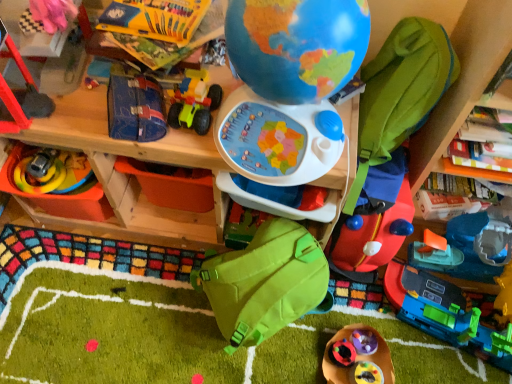
Question: Is blue fabric case at center, which ranks as the 3th toy in left-to-right order, surrounding rubberized red backpack at center-right, which is the first toy in right-to-left order?

Choices:
 (A) yes
 (B) no

Answer: (B)

Question: Is blue fabric case at center, which ranks as the 3th toy in left-to-right order, in front of rubberized red backpack at center-right, acting as the eleventh toy starting from the left?

Choices:
 (A) yes
 (B) no

Answer: (A)

Question: Considering the relative positions of blue fabric case at center, which ranks as the 3th toy in left-to-right order, and rubberized red backpack at center-right, acting as the eleventh toy starting from the left, in the image provided, is blue fabric case at center, which ranks as the 3th toy in left-to-right order, to the right of rubberized red backpack at center-right, acting as the eleventh toy starting from the left, from the viewer's perspective?

Choices:
 (A) no
 (B) yes

Answer: (A)

Question: From a real-world perspective, does blue fabric case at center, which ranks as the 3th toy in left-to-right order, stand above rubberized red backpack at center-right, which is the first toy in right-to-left order?

Choices:
 (A) no
 (B) yes

Answer: (B)

Question: Considering the relative sizes of blue fabric case at center, positioned as the 9th toy in right-to-left order, and rubberized red backpack at center-right, which is the first toy in right-to-left order, in the image provided, is blue fabric case at center, positioned as the 9th toy in right-to-left order, smaller than rubberized red backpack at center-right, which is the first toy in right-to-left order,?

Choices:
 (A) yes
 (B) no

Answer: (A)

Question: From the image's perspective, would you say blue fabric case at center, positioned as the 9th toy in right-to-left order, is shown under rubberized red backpack at center-right, acting as the eleventh toy starting from the left?

Choices:
 (A) no
 (B) yes

Answer: (A)

Question: From a real-world perspective, is green matte backpack at center, the seventh toy when ordered from right to left, physically below rubberized red ladder at left, which appears as the 10th toy when viewed from the right?

Choices:
 (A) no
 (B) yes

Answer: (B)

Question: Is green matte backpack at center, positioned as the fifth toy in left-to-right order, smaller than rubberized red ladder at left, which is the 2th toy in left-to-right order?

Choices:
 (A) yes
 (B) no

Answer: (A)

Question: Does green matte backpack at center, positioned as the fifth toy in left-to-right order, lie in front of rubberized red ladder at left, which appears as the 10th toy when viewed from the right?

Choices:
 (A) no
 (B) yes

Answer: (A)

Question: Does green matte backpack at center, positioned as the fifth toy in left-to-right order, contain rubberized red ladder at left, which appears as the 10th toy when viewed from the right?

Choices:
 (A) no
 (B) yes

Answer: (A)

Question: From a real-world perspective, is green matte backpack at center, positioned as the fifth toy in left-to-right order, over rubberized red ladder at left, which appears as the 10th toy when viewed from the right?

Choices:
 (A) yes
 (B) no

Answer: (B)

Question: Is green matte backpack at center, positioned as the fifth toy in left-to-right order, to the right of rubberized red ladder at left, which appears as the 10th toy when viewed from the right, from the viewer's perspective?

Choices:
 (A) yes
 (B) no

Answer: (A)

Question: Is wooden table at center not near rubberized plastic toy at lower center, the 3th toy viewed from the right?

Choices:
 (A) yes
 (B) no

Answer: (B)